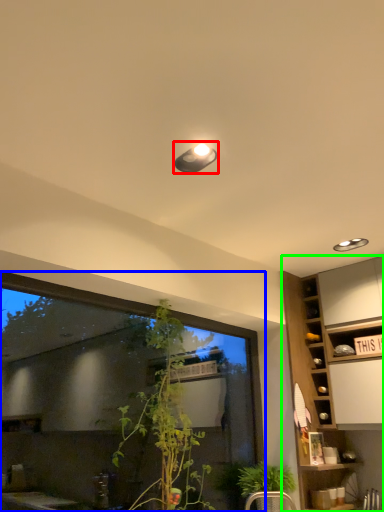
Question: Estimate the real-world distances between objects in this image. Which object is farther from light fixture (highlighted by a red box), window (highlighted by a blue box) or cabinetry (highlighted by a green box)?

Choices:
 (A) window
 (B) cabinetry

Answer: (B)